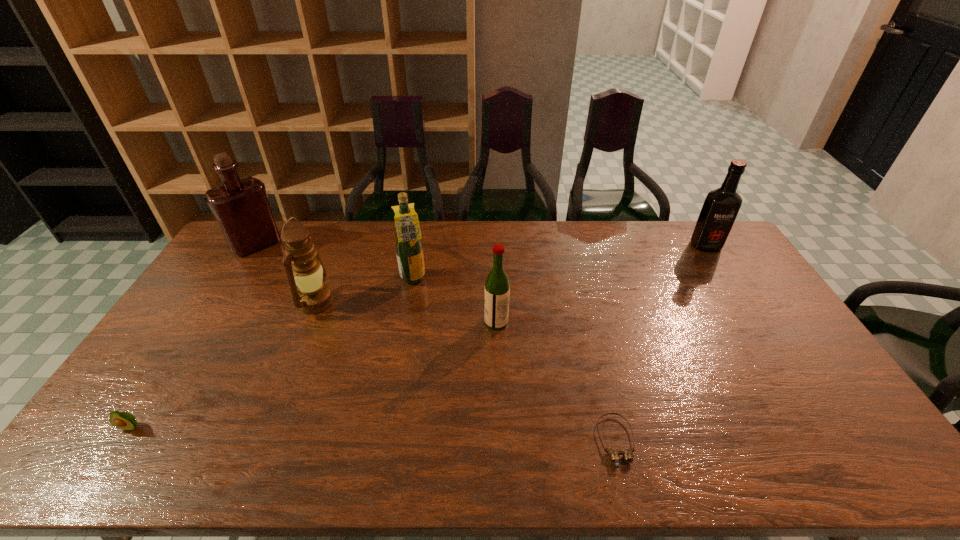
The width and height of the screenshot is (960, 540). I want to click on free space that satisfies the following two spatial constraints: 1. on the front-facing side of the rightmost object; 2. on the front-facing side of the fourth object from left to right, so click(x=727, y=280).